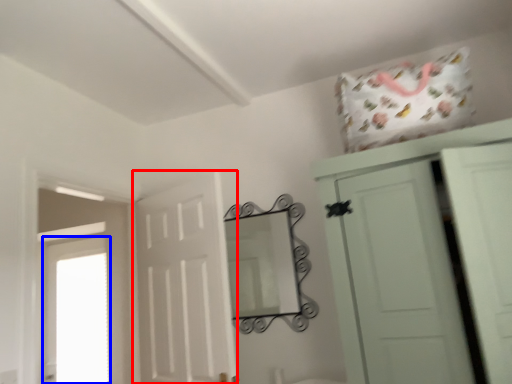
Question: Which of the following is the closest to the observer, door (highlighted by a red box) or window (highlighted by a blue box)?

Choices:
 (A) door
 (B) window

Answer: (A)